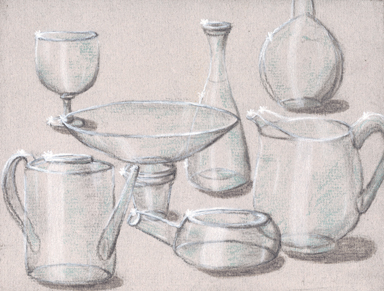
You are a GUI agent. You are given a task and a screenshot of the screen. Output one action in this format:
    pyautogui.click(x=<x>, y=<y>)
    Task: Click on the bottles
    This screenshot has width=384, height=291.
    Given the screenshot: What is the action you would take?
    pyautogui.click(x=238, y=170), pyautogui.click(x=308, y=69)